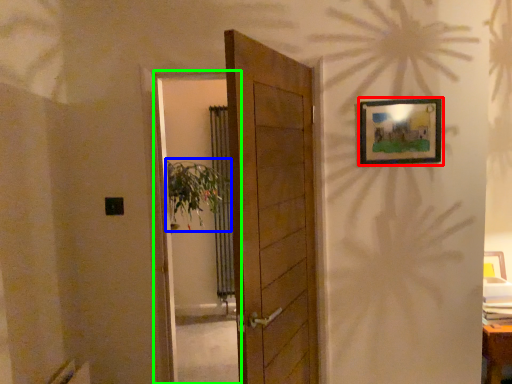
Question: Considering the real-world distances, which object is closest to picture frame (highlighted by a red box)? plant (highlighted by a blue box) or screen door (highlighted by a green box).

Choices:
 (A) plant
 (B) screen door

Answer: (A)